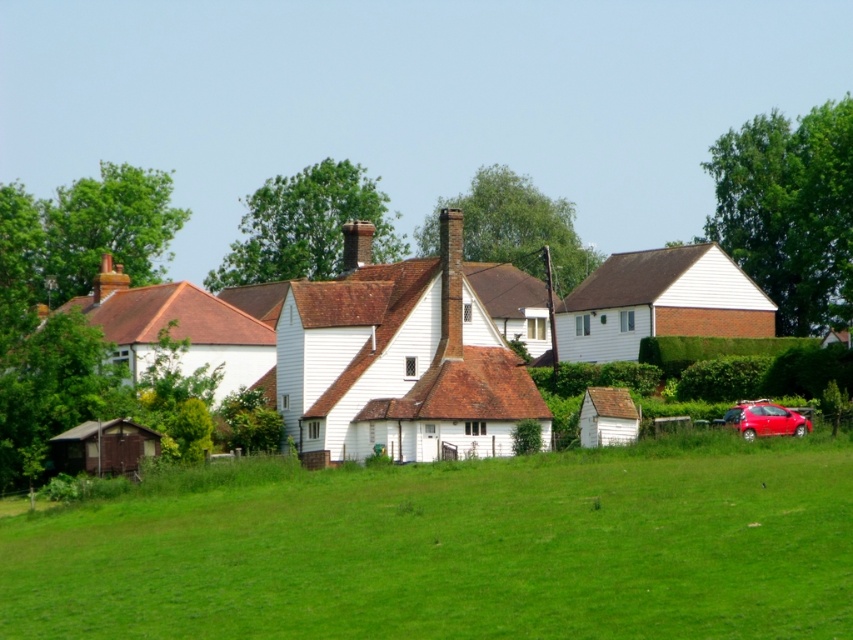
Question: Which object is closer to the camera taking this photo?

Choices:
 (A) green leafy tree at center
 (B) shiny red hatchback at lower right
 (C) green leafy tree at upper center
 (D) green leafy tree at upper right

Answer: (B)

Question: Among these points, which one is farthest from the camera?

Choices:
 (A) (693, 480)
 (B) (469, 243)

Answer: (B)

Question: Does green grass at lower center appear on the left side of green leafy tree at upper center?

Choices:
 (A) no
 (B) yes

Answer: (A)

Question: Does green leafy tree at upper center have a lesser width compared to green leafy tree at center?

Choices:
 (A) no
 (B) yes

Answer: (A)

Question: Which point is closer to the camera?

Choices:
 (A) green leafy tree at upper center
 (B) green leafy tree at upper right

Answer: (A)

Question: Does green grass at lower center lie behind green leafy tree at upper center?

Choices:
 (A) yes
 (B) no

Answer: (B)